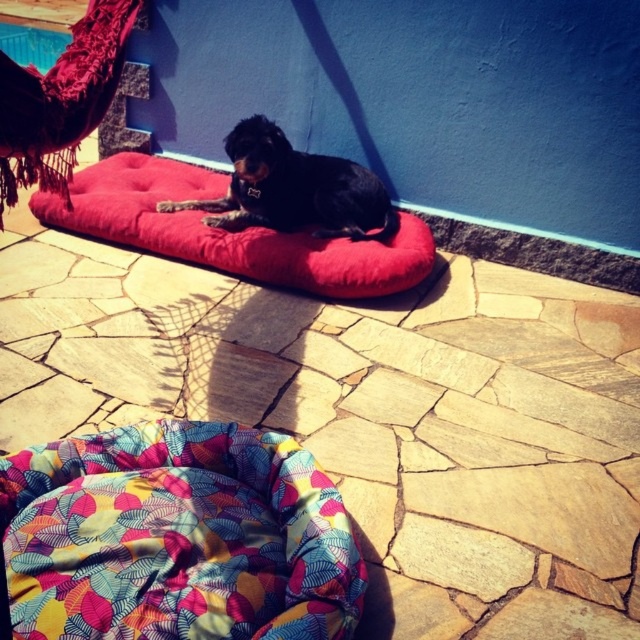
Who is lower down, velvet red dog bed at center or black smooth dog at center?

velvet red dog bed at center

The width and height of the screenshot is (640, 640). In order to click on velvet red dog bed at center in this screenshot , I will do `click(228, 230)`.

Who is more forward, (96, 433) or (244, 141)?

Point (96, 433)

Can you confirm if multicolored fabric bean bag at center is positioned above black smooth dog at center?

Incorrect, multicolored fabric bean bag at center is not positioned above black smooth dog at center.

Between point (362, 598) and point (276, 132), which one is positioned behind?

The point (276, 132) is behind.

Image resolution: width=640 pixels, height=640 pixels. Find the location of `multicolored fabric bean bag at center`. multicolored fabric bean bag at center is located at coordinates click(177, 538).

Is multicolored fabric bean bag at center to the right of velvet red dog bed at center from the viewer's perspective?

Correct, you'll find multicolored fabric bean bag at center to the right of velvet red dog bed at center.

What do you see at coordinates (177, 538) in the screenshot?
I see `multicolored fabric bean bag at center` at bounding box center [177, 538].

Is point (250, 476) closer to camera compared to point (224, 189)?

Yes, point (250, 476) is closer to viewer.

You are a GUI agent. You are given a task and a screenshot of the screen. Output one action in this format:
    pyautogui.click(x=<x>, y=<y>)
    Task: Click on the multicolored fabric bean bag at center
    This screenshot has height=640, width=640.
    Given the screenshot: What is the action you would take?
    pyautogui.click(x=177, y=538)